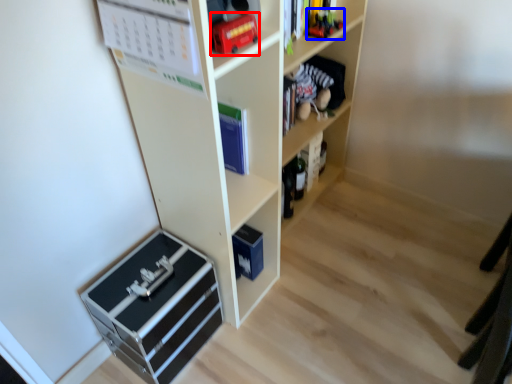
Question: Which of the following is the closest to the observer, toy (highlighted by a red box) or toy (highlighted by a blue box)?

Choices:
 (A) toy
 (B) toy

Answer: (A)